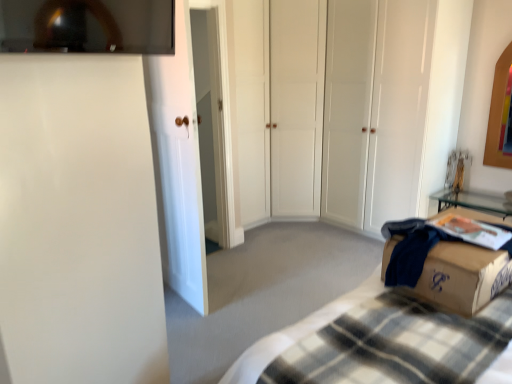
The width and height of the screenshot is (512, 384). What do you see at coordinates (460, 275) in the screenshot?
I see `brown cardboard box at lower right` at bounding box center [460, 275].

Describe the element at coordinates (500, 113) in the screenshot. I see `wooden picture frame at upper right` at that location.

This screenshot has width=512, height=384. Describe the element at coordinates (361, 113) in the screenshot. I see `white matte closet doors at center, the 1th glass door positioned from the back` at that location.

Identify the location of white glossy door at left, which is the 2th glass door from right to left. (178, 164).

Which point is more forward, [183,0] or [378,333]?

The point [378,333] is in front.

From the image's perspective, is white glossy door at left, the 1th glass door viewed from the front, below plaid fabric bed at lower right?

No, from the image's perspective, white glossy door at left, the 1th glass door viewed from the front, is not below plaid fabric bed at lower right.

Between white glossy door at left, the 1th glass door viewed from the front, and plaid fabric bed at lower right, which one has smaller size?

With smaller size is white glossy door at left, the 1th glass door viewed from the front.

Between white glossy door at left, which is the 2th glass door from right to left, and plaid fabric bed at lower right, which one appears on the right side from the viewer's perspective?

Positioned to the right is plaid fabric bed at lower right.

From a real-world perspective, relative to wooden picture frame at upper right, is white glossy door at left, which is the 2th glass door from right to left, vertically above or below?

white glossy door at left, which is the 2th glass door from right to left, is below wooden picture frame at upper right.

Considering the sizes of white glossy door at left, which is the 2th glass door from right to left, and wooden picture frame at upper right in the image, is white glossy door at left, which is the 2th glass door from right to left, wider or thinner than wooden picture frame at upper right?

white glossy door at left, which is the 2th glass door from right to left, is wider than wooden picture frame at upper right.

Is white glossy door at left, which ranks as the 1th glass door in left-to-right order, far away from wooden picture frame at upper right?

Absolutely, white glossy door at left, which ranks as the 1th glass door in left-to-right order, is distant from wooden picture frame at upper right.

The width and height of the screenshot is (512, 384). I want to click on the 2nd glass door behind the brown cardboard box at lower right, counting from the anchor's position, so click(x=361, y=113).

Can you confirm if brown cardboard box at lower right is bigger than white matte closet doors at center, which appears as the first glass door when viewed from the right?

Actually, brown cardboard box at lower right might be smaller than white matte closet doors at center, which appears as the first glass door when viewed from the right.

Is brown cardboard box at lower right looking in the opposite direction of white matte closet doors at center, which is the 2th glass door from left to right?

No, brown cardboard box at lower right is not facing the opposite direction of white matte closet doors at center, which is the 2th glass door from left to right.

Is plaid fabric bed at lower right bigger or smaller than brown cardboard box at lower right?

Considering their sizes, plaid fabric bed at lower right takes up more space than brown cardboard box at lower right.

Considering the points (434, 283) and (429, 290), which point is in front, point (434, 283) or point (429, 290)?

Positioned in front is point (434, 283).

In the scene shown: Would you say plaid fabric bed at lower right is inside or outside brown cardboard box at lower right?

plaid fabric bed at lower right is not inside brown cardboard box at lower right, it's outside.

Based on the photo, can you confirm if plaid fabric bed at lower right is positioned to the right of brown cardboard box at lower right?

In fact, plaid fabric bed at lower right is to the left of brown cardboard box at lower right.

Which of these two, wooden picture frame at upper right or brown cardboard box at lower right, is smaller?

wooden picture frame at upper right.

From a real-world perspective, which object stands above the other?

wooden picture frame at upper right, from a real-world perspective.

Do you think wooden picture frame at upper right is within brown cardboard box at lower right, or outside of it?

wooden picture frame at upper right is outside brown cardboard box at lower right.

Is wooden picture frame at upper right facing away from brown cardboard box at lower right?

No, wooden picture frame at upper right is not facing away from brown cardboard box at lower right.

Are transparent glass tv at upper center and plaid fabric bed at lower right beside each other?

No, transparent glass tv at upper center is not beside plaid fabric bed at lower right.

In the image, is transparent glass tv at upper center on the left side or the right side of plaid fabric bed at lower right?

Clearly, transparent glass tv at upper center is on the left of plaid fabric bed at lower right in the image.

In terms of width, does transparent glass tv at upper center look wider or thinner when compared to plaid fabric bed at lower right?

Clearly, transparent glass tv at upper center has less width compared to plaid fabric bed at lower right.

You are a GUI agent. You are given a task and a screenshot of the screen. Output one action in this format:
    pyautogui.click(x=<x>, y=<y>)
    Task: Click on the bed on the right of transparent glass tv at upper center
    Image resolution: width=512 pixels, height=384 pixels.
    Given the screenshot: What is the action you would take?
    pyautogui.click(x=399, y=329)

Who is smaller, plaid fabric bed at lower right or white glossy door at left, which is the 2th glass door from right to left?

Smaller between the two is white glossy door at left, which is the 2th glass door from right to left.

Are plaid fabric bed at lower right and white glossy door at left, the second glass door positioned from the back, located far from each other?

Yes.

Could white glossy door at left, which ranks as the 1th glass door in left-to-right order, be considered to be inside plaid fabric bed at lower right?

No, white glossy door at left, which ranks as the 1th glass door in left-to-right order, is located outside of plaid fabric bed at lower right.

Image resolution: width=512 pixels, height=384 pixels. I want to click on bed below the white glossy door at left, the 1th glass door viewed from the front (from a real-world perspective), so click(399, 329).

Which glass door is the 1st one when counting from the back of the plaid fabric bed at lower right? Please provide its 2D coordinates.

[(178, 164)]

The height and width of the screenshot is (384, 512). In order to click on glass door that is the 2nd object directly below the wooden picture frame at upper right (from a real-world perspective) in this screenshot , I will do `click(178, 164)`.

When comparing their distances from white matte closet doors at center, which is the second glass door in front-to-back order, does brown cardboard box at lower right or wooden picture frame at upper right seem closer?

wooden picture frame at upper right.

Looking at the image, which one is located closer to white glossy door at left, which ranks as the 1th glass door in left-to-right order, white matte closet doors at center, which is the 2th glass door from left to right, or brown cardboard box at lower right?

brown cardboard box at lower right is closer to white glossy door at left, which ranks as the 1th glass door in left-to-right order.

Considering their positions, is transparent glass tv at upper center positioned further to white matte closet doors at center, which is the 2th glass door from left to right, than plaid fabric bed at lower right?

The object further to white matte closet doors at center, which is the 2th glass door from left to right, is transparent glass tv at upper center.

Estimate the real-world distances between objects in this image. Which object is closer to transparent glass tv at upper center, white matte closet doors at center, which is the 2th glass door from left to right, or white glossy door at left, the 1th glass door viewed from the front?

Among the two, white glossy door at left, the 1th glass door viewed from the front, is located nearer to transparent glass tv at upper center.

Based on their spatial positions, is plaid fabric bed at lower right or white matte closet doors at center, which appears as the first glass door when viewed from the right, closer to wooden picture frame at upper right?

Among the two, white matte closet doors at center, which appears as the first glass door when viewed from the right, is located nearer to wooden picture frame at upper right.

From the image, which object appears to be nearer to wooden picture frame at upper right, white matte closet doors at center, which is the second glass door in front-to-back order, or white glossy door at left, which ranks as the 1th glass door in left-to-right order?

white matte closet doors at center, which is the second glass door in front-to-back order, is closer to wooden picture frame at upper right.

Which object lies further to the anchor point white matte closet doors at center, which is the 2th glass door from left to right, plaid fabric bed at lower right or brown cardboard box at lower right?

Based on the image, brown cardboard box at lower right appears to be further to white matte closet doors at center, which is the 2th glass door from left to right.

When comparing their distances from brown cardboard box at lower right, does white matte closet doors at center, which is the second glass door in front-to-back order, or transparent glass tv at upper center seem further?

The object further to brown cardboard box at lower right is white matte closet doors at center, which is the second glass door in front-to-back order.

Where is `bed positioned between transparent glass tv at upper center and white glossy door at left, which is the 2th glass door from right to left, from near to far`? bed positioned between transparent glass tv at upper center and white glossy door at left, which is the 2th glass door from right to left, from near to far is located at coordinates (399, 329).

The width and height of the screenshot is (512, 384). What are the coordinates of `box between plaid fabric bed at lower right and wooden picture frame at upper right in the front-back direction` in the screenshot? It's located at (460, 275).

What are the coordinates of `bed positioned between transparent glass tv at upper center and wooden picture frame at upper right from near to far` in the screenshot? It's located at (399, 329).

This screenshot has width=512, height=384. Identify the location of glass door located between transparent glass tv at upper center and white matte closet doors at center, which is the 2th glass door from left to right, in the depth direction. (178, 164).